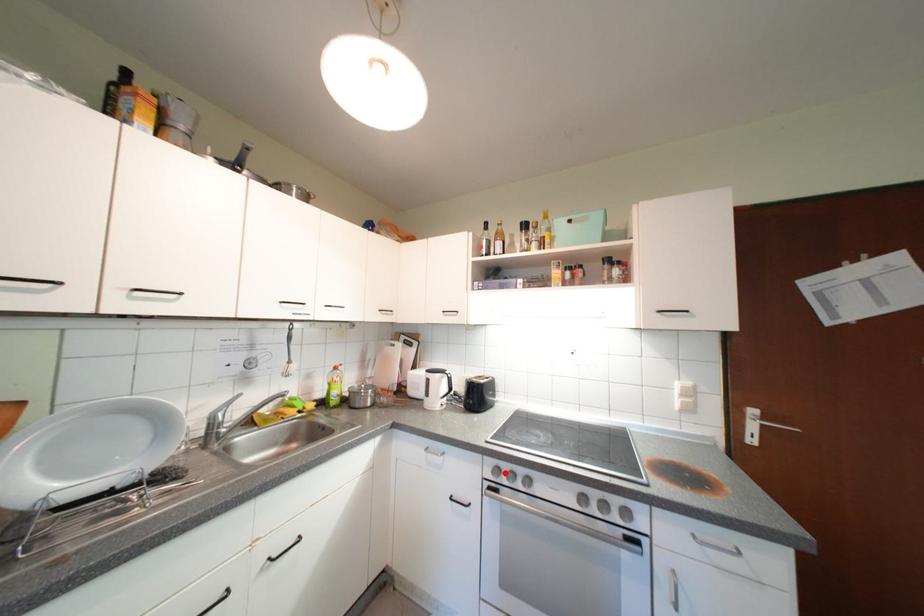
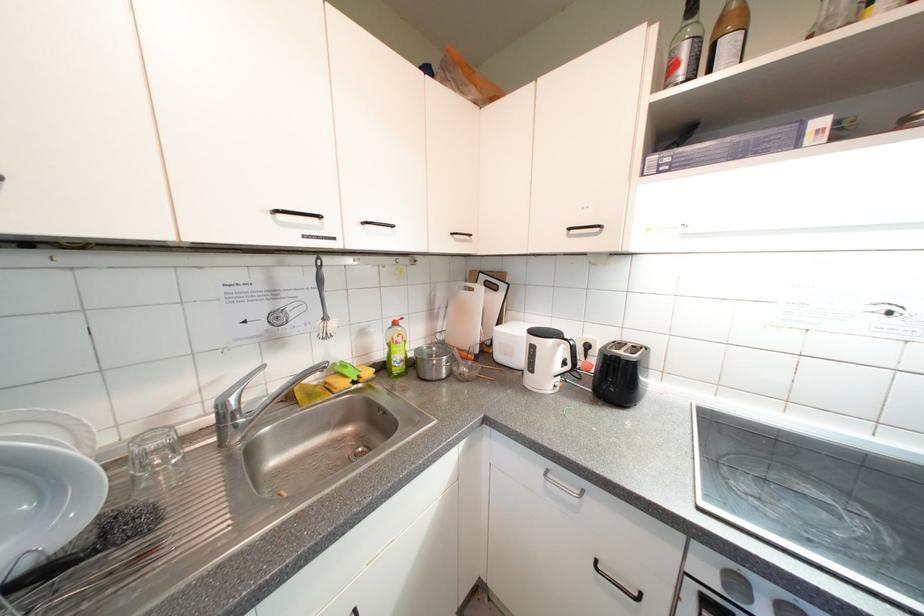
Question: I am providing you with two images of the same scene from different viewpoints. Given a red point in image1, look at the same physical point in image2. Is it:

Choices:
 (A) Closer to the viewpoint
 (B) Farther from the viewpoint

Answer: (A)